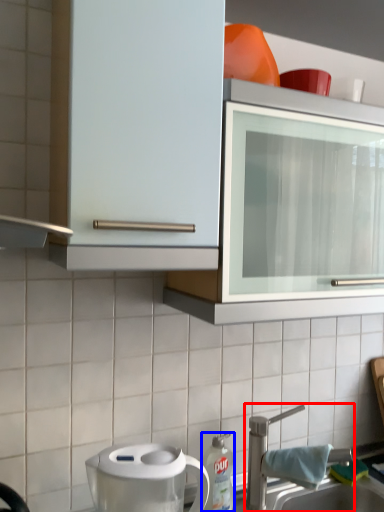
Question: Which point is closer to the camera, tap (highlighted by a red box) or kitchen appliance (highlighted by a blue box)?

Choices:
 (A) tap
 (B) kitchen appliance

Answer: (A)